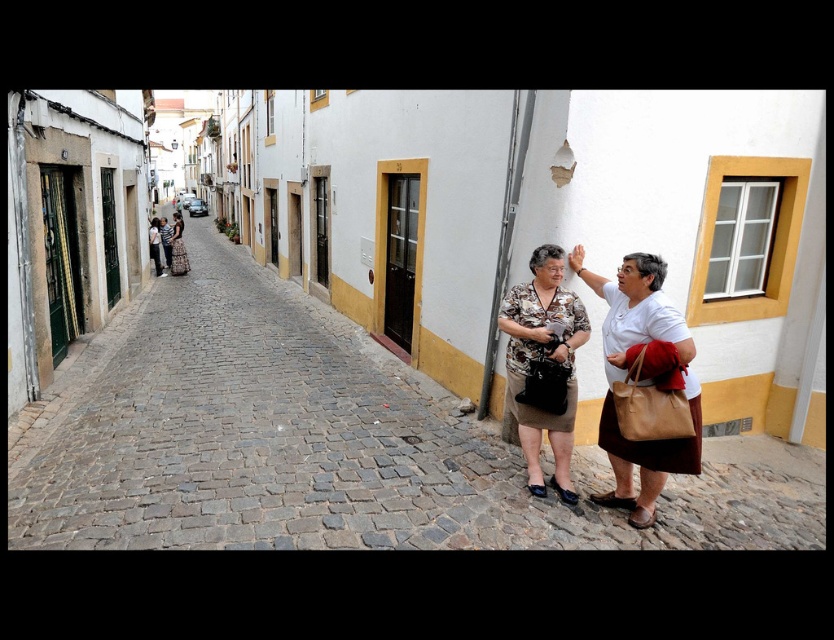
Question: Can you confirm if matte white shirt at center is positioned above matte black dress at center?

Choices:
 (A) yes
 (B) no

Answer: (B)

Question: Observing the image, what is the correct spatial positioning of matte white shirt at center in reference to brown textured skirt at center?

Choices:
 (A) below
 (B) above

Answer: (B)

Question: Which object appears closest to the camera in this image?

Choices:
 (A) matte black dress at center
 (B) brown textured skirt at center
 (C) matte white shirt at center

Answer: (C)

Question: Which object is closer to the camera taking this photo?

Choices:
 (A) matte white shirt at center
 (B) matte black dress at center

Answer: (A)

Question: Does matte white shirt at center appear on the right side of matte black dress at center?

Choices:
 (A) yes
 (B) no

Answer: (A)

Question: Among these points, which one is farthest from the camera?

Choices:
 (A) [676, 458]
 (B) [541, 324]

Answer: (B)